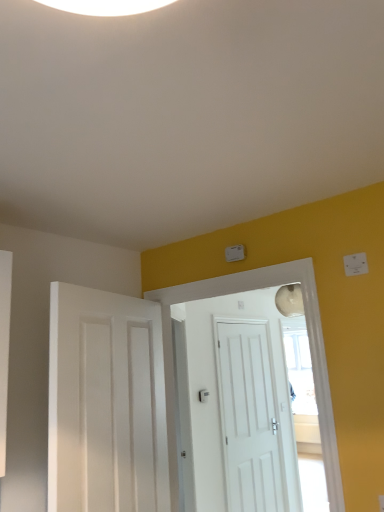
Question: Are white plastic light switch at upper right and white matte door at center, which is the second door from back to front, beside each other?

Choices:
 (A) yes
 (B) no

Answer: (B)

Question: Can you confirm if white plastic light switch at upper right is bigger than white matte door at center, which is the second door from back to front?

Choices:
 (A) yes
 (B) no

Answer: (B)

Question: From a real-world perspective, is white plastic light switch at upper right on white matte door at center, acting as the second door starting from the front?

Choices:
 (A) yes
 (B) no

Answer: (A)

Question: From a real-world perspective, is white plastic light switch at upper right located beneath white matte door at center, which is the second door from back to front?

Choices:
 (A) yes
 (B) no

Answer: (B)

Question: Is white plastic light switch at upper right looking in the opposite direction of white matte door at center, which is the second door from back to front?

Choices:
 (A) no
 (B) yes

Answer: (A)

Question: Considering the positions of white plastic light switch at upper right and white matte door at center, which is the second door from back to front, in the image, is white plastic light switch at upper right wider or thinner than white matte door at center, which is the second door from back to front,?

Choices:
 (A) wide
 (B) thin

Answer: (B)

Question: Is white plastic light switch at upper right spatially inside white matte door at center, which is the second door from back to front, or outside of it?

Choices:
 (A) outside
 (B) inside

Answer: (A)

Question: Is white plastic light switch at upper right to the left or to the right of white matte door at center, which is the second door from back to front, in the image?

Choices:
 (A) left
 (B) right

Answer: (B)

Question: Is point (364, 271) positioned closer to the camera than point (336, 490)?

Choices:
 (A) farther
 (B) closer

Answer: (A)

Question: Is point coord(218,337) closer or farther from the camera than point coord(364,254)?

Choices:
 (A) closer
 (B) farther

Answer: (B)

Question: Is white matte door at center, arranged as the third door when viewed from the front, inside the boundaries of white plastic light switch at upper right, or outside?

Choices:
 (A) inside
 (B) outside

Answer: (B)

Question: In terms of width, does white matte door at center, marked as the first door in a back-to-front arrangement, look wider or thinner when compared to white plastic light switch at upper right?

Choices:
 (A) wide
 (B) thin

Answer: (A)

Question: Relative to white plastic light switch at upper right, is white matte door at center, arranged as the third door when viewed from the front, in front or behind?

Choices:
 (A) behind
 (B) front

Answer: (A)

Question: In terms of size, does white matte door at left, which is the first door in front-to-back order, appear bigger or smaller than white matte door at center, arranged as the third door when viewed from the front?

Choices:
 (A) small
 (B) big

Answer: (B)

Question: Is white matte door at left, which is the first door in front-to-back order, in front of or behind white matte door at center, arranged as the third door when viewed from the front, in the image?

Choices:
 (A) front
 (B) behind

Answer: (A)